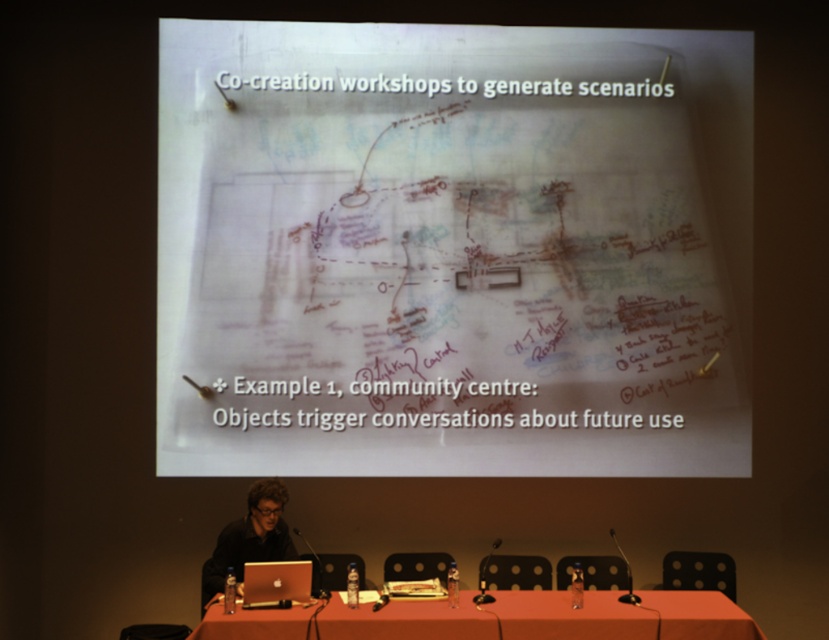
Which is more to the right, white paper at upper center or smooth orange table at center?

Positioned to the right is smooth orange table at center.

In the scene shown: Who is shorter, white paper at upper center or smooth orange table at center?

smooth orange table at center

Locate an element on the screen. Image resolution: width=829 pixels, height=640 pixels. white paper at upper center is located at coordinates (452, 250).

Image resolution: width=829 pixels, height=640 pixels. What are the coordinates of `white paper at upper center` in the screenshot? It's located at (452, 250).

Between black matte laptop at lower left and silver metallic laptop at center, which one has more height?

black matte laptop at lower left

Between black matte laptop at lower left and silver metallic laptop at center, which one appears on the left side from the viewer's perspective?

From the viewer's perspective, black matte laptop at lower left appears more on the left side.

Who is more forward, [255,525] or [274,566]?

Point [274,566]

At what (x,y) coordinates should I click in order to perform the action: click on black matte laptop at lower left. Please return your answer as a coordinate pair (x, y). This screenshot has width=829, height=640. Looking at the image, I should click on (250, 538).

From the picture: Is white paper at upper center thinner than silver metallic laptop at center?

In fact, white paper at upper center might be wider than silver metallic laptop at center.

Does point (571, 216) come farther from viewer compared to point (260, 595)?

Yes, point (571, 216) is behind point (260, 595).

Is point (188, 32) behind point (304, 570)?

Yes, point (188, 32) is farther from viewer.

This screenshot has width=829, height=640. What are the coordinates of `white paper at upper center` in the screenshot? It's located at (452, 250).